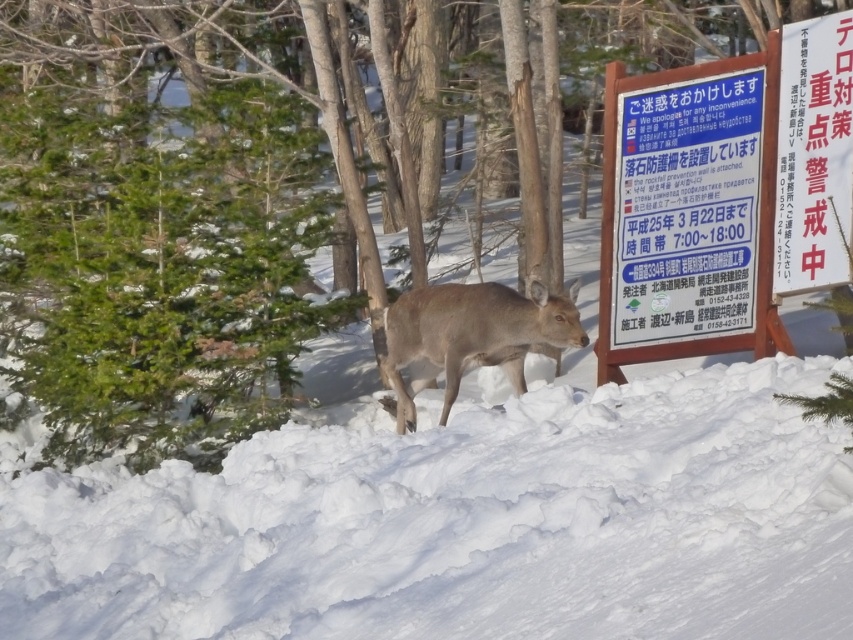
Question: Among these objects, which one is nearest to the camera?

Choices:
 (A) white paper sign at upper right
 (B) brown matte deer at center
 (C) white wooden sign at center-right

Answer: (A)

Question: Is white paper sign at upper right positioned behind brown matte deer at center?

Choices:
 (A) yes
 (B) no

Answer: (B)

Question: Can you confirm if white wooden sign at center-right is positioned below brown matte deer at center?

Choices:
 (A) no
 (B) yes

Answer: (A)

Question: Among these objects, which one is farthest from the camera?

Choices:
 (A) white wooden sign at center-right
 (B) white paper sign at upper right
 (C) brown matte deer at center

Answer: (C)

Question: Which of these objects is positioned farthest from the white wooden sign at center-right?

Choices:
 (A) brown matte deer at center
 (B) white paper sign at upper right
 (C) white fluffy snow at center

Answer: (C)

Question: Is the position of white fluffy snow at center more distant than that of white wooden sign at center-right?

Choices:
 (A) yes
 (B) no

Answer: (B)